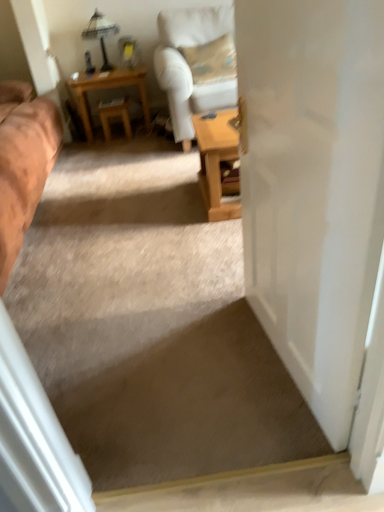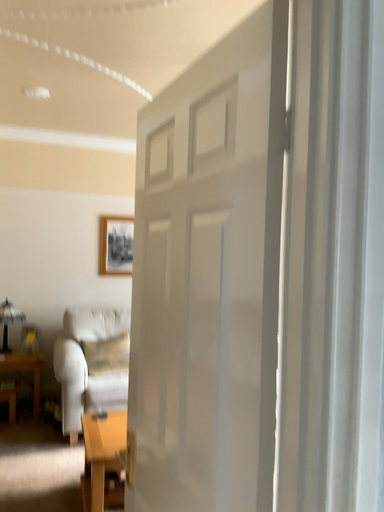
Question: Which way did the camera rotate in the video?

Choices:
 (A) rotated right
 (B) rotated left

Answer: (A)